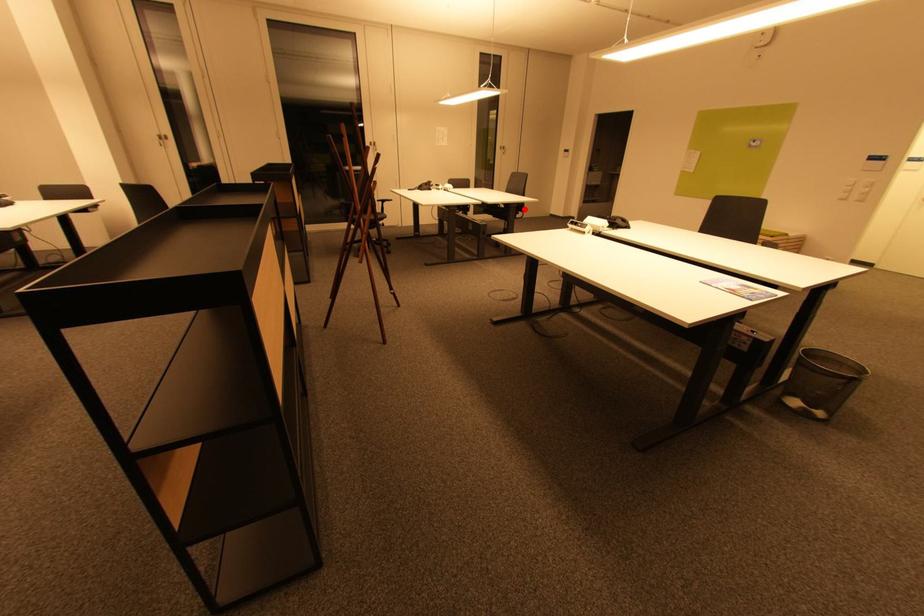
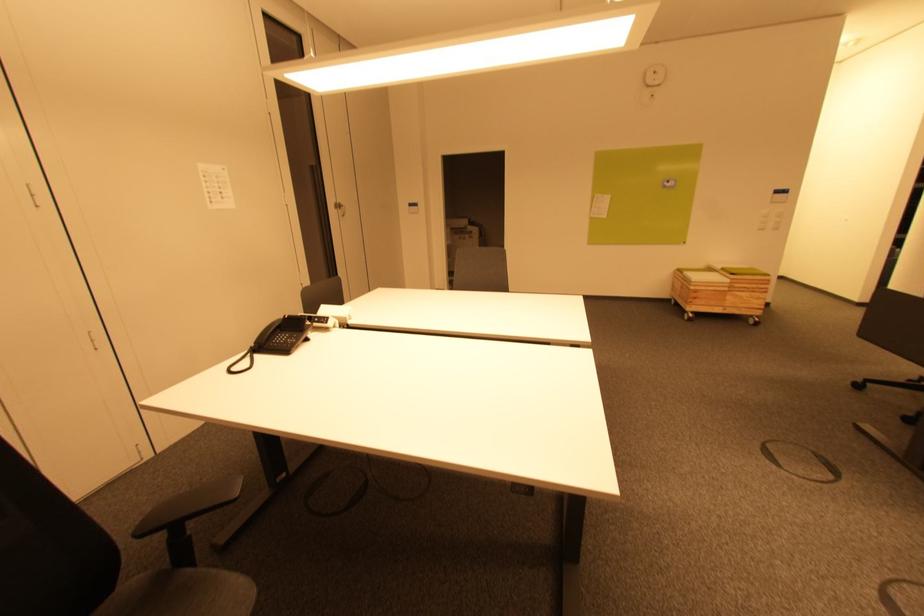
Question: I am providing you with two images of the same scene from different viewpoints. A red point is marked on the first image. At the location where the point appears in image 1, is it still visible in image 2?

Choices:
 (A) Yes
 (B) No

Answer: (B)